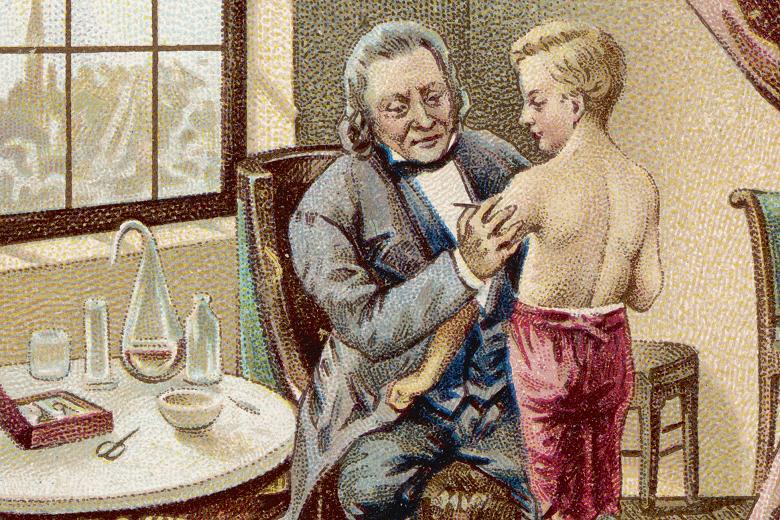
This screenshot has height=520, width=780. Identify the location of flask. (137, 351).